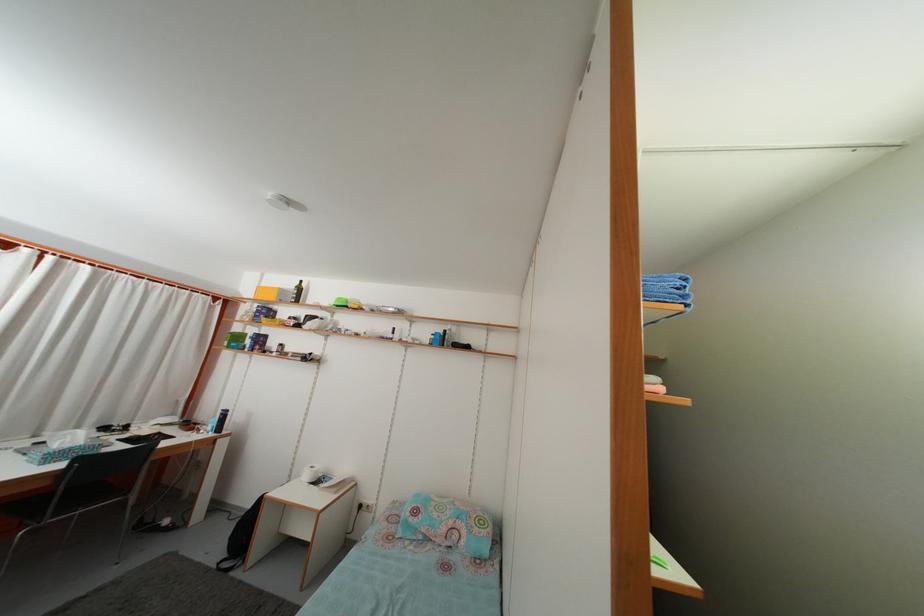
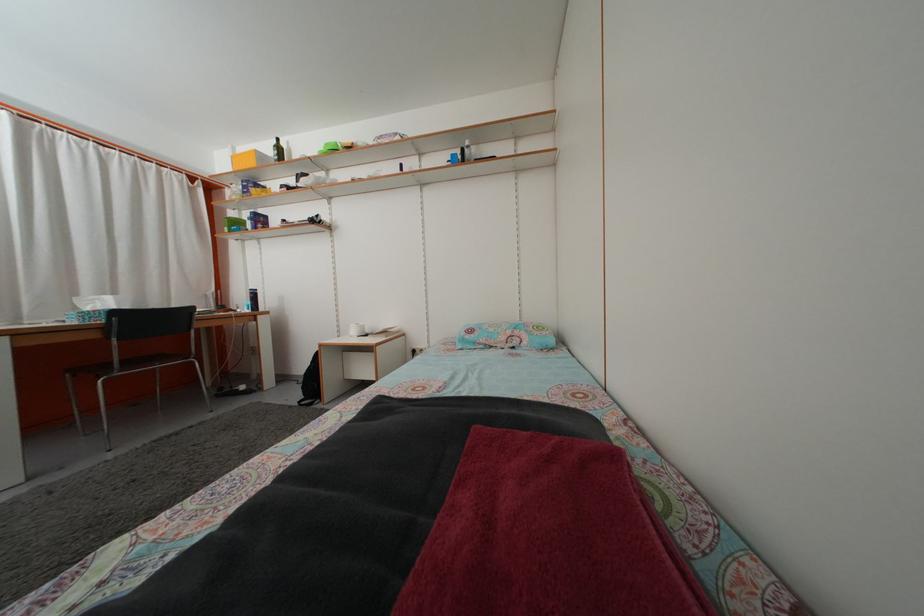
Question: Based on the continuous images, in which direction is the camera rotating? Reply with the corresponding letter.

Choices:
 (A) Left
 (B) Right
 (C) Up
 (D) Down

Answer: (D)